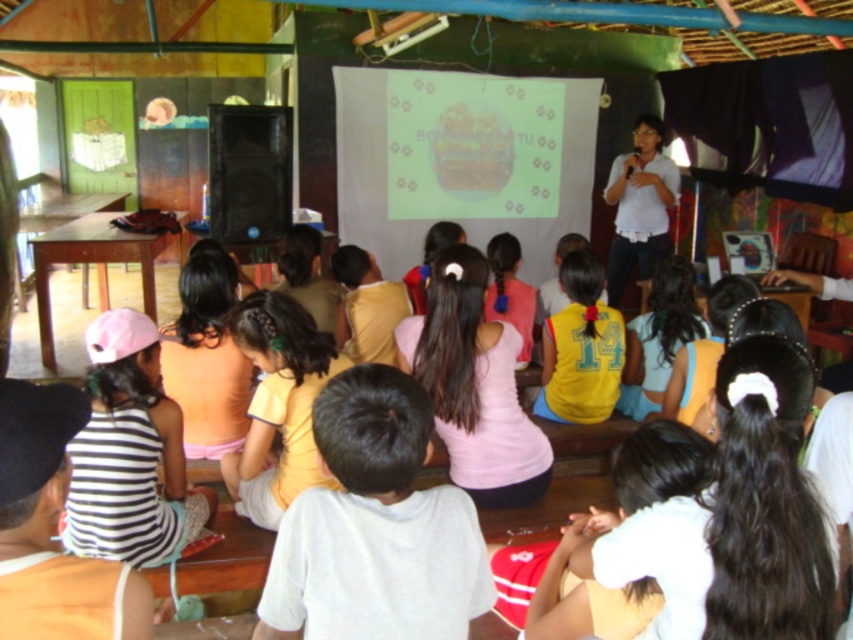
Question: Which object is closer to the camera taking this photo?

Choices:
 (A) white cotton shirt at center
 (B) yellow matte shirt at center
 (C) white matte shirt at upper right
 (D) pink matte tank top at center

Answer: (A)

Question: Which point is closer to the camera?

Choices:
 (A) (438, 336)
 (B) (273, 417)
 (C) (648, 212)
 (D) (370, 524)

Answer: (D)

Question: Is white cotton shirt at center thinner than yellow matte shirt at center?

Choices:
 (A) yes
 (B) no

Answer: (A)

Question: Is white cotton shirt at center wider than yellow matte shirt at center?

Choices:
 (A) yes
 (B) no

Answer: (B)

Question: Which object is closer to the camera taking this photo?

Choices:
 (A) yellow matte shirt at center
 (B) pink matte tank top at center

Answer: (A)

Question: Is white cotton shirt at center below pink matte tank top at center?

Choices:
 (A) yes
 (B) no

Answer: (A)